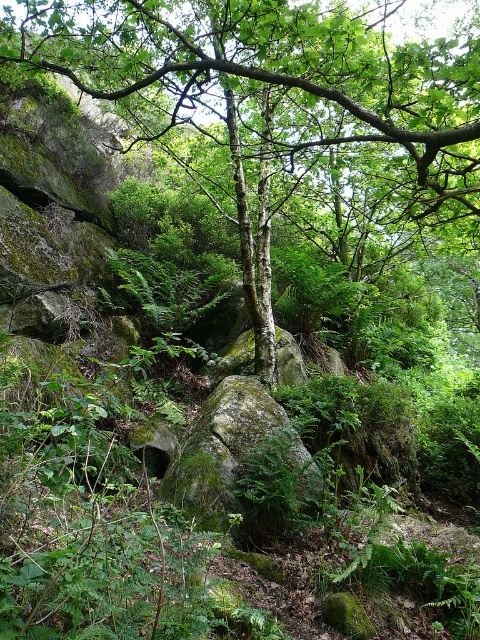
You are navigating through the forest and see two points marked in the scene. Which point is closer to you, point (x=405, y=60) or point (x=203, y=509)?

Point (x=203, y=509) is closer to you because the description states that point (x=405, y=60) is behind point (x=203, y=509).

You are a hiker in the forest and want to take a photo of both the green mossy tree at center and the green mossy rock at center. Since they are both at the center, which one should you move towards to get both in the frame?

The green mossy tree at center is to the right of green mossy rock at center, so you should move towards the center and position yourself between them to capture both in the frame.